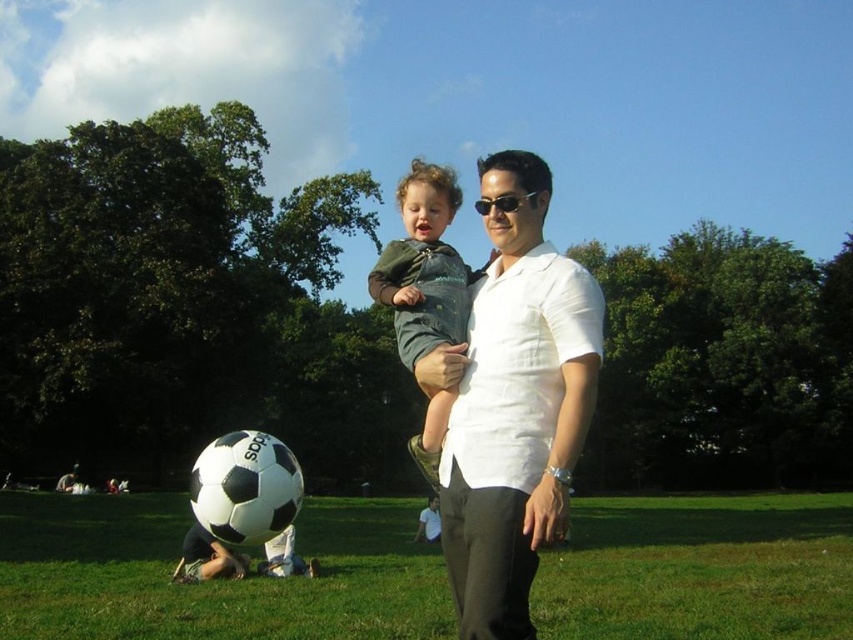
Question: Is green grass at lower center thinner than white linen shirt at center?

Choices:
 (A) yes
 (B) no

Answer: (B)

Question: Which of the following is the closest to the observer?

Choices:
 (A) green denim overalls at center
 (B) white linen shirt at center
 (C) green grass at lower center

Answer: (B)

Question: Does green grass at lower center appear on the left side of green denim overalls at center?

Choices:
 (A) no
 (B) yes

Answer: (A)

Question: Can you confirm if green grass at lower center is positioned above white linen shirt at center?

Choices:
 (A) yes
 (B) no

Answer: (B)

Question: Which point is farther from the camera taking this photo?

Choices:
 (A) (3, 566)
 (B) (404, 301)

Answer: (A)

Question: Which is farther from the white linen shirt at center?

Choices:
 (A) green denim overalls at center
 (B) green grass at lower center

Answer: (B)